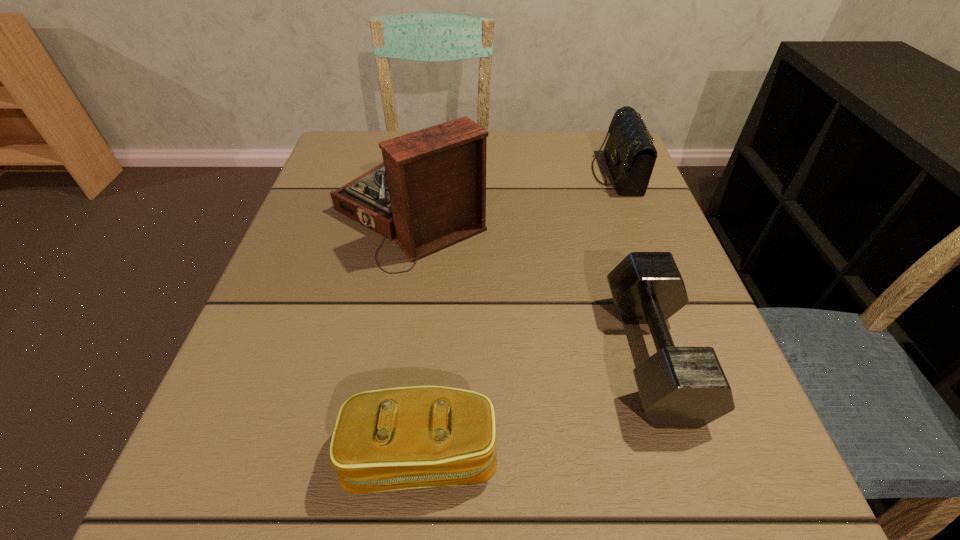
Where is `blank space located on the left of the dumbbell`? blank space located on the left of the dumbbell is located at coordinates (348, 355).

This screenshot has width=960, height=540. I want to click on phonograph record that is at the far edge, so click(x=430, y=190).

This screenshot has width=960, height=540. What are the coordinates of `clutch bag that is at the far edge` in the screenshot? It's located at (629, 152).

At what (x,y) coordinates should I click in order to perform the action: click on object that is at the near edge. Please return your answer as a coordinate pair (x, y). Looking at the image, I should click on (400, 438).

The width and height of the screenshot is (960, 540). I want to click on object at the left edge, so click(x=430, y=190).

Where is `clutch bag situated at the right edge`? Image resolution: width=960 pixels, height=540 pixels. clutch bag situated at the right edge is located at coordinates (629, 152).

This screenshot has height=540, width=960. What are the coordinates of `dumbbell that is at the right edge` in the screenshot? It's located at (680, 387).

At what (x,y) coordinates should I click in order to perform the action: click on object situated at the far left corner. Please return your answer as a coordinate pair (x, y). Looking at the image, I should click on (430, 190).

This screenshot has width=960, height=540. I want to click on object present at the far right corner, so click(x=629, y=152).

Find the location of a particular element. Image resolution: width=960 pixels, height=540 pixels. free space at the far edge is located at coordinates (510, 158).